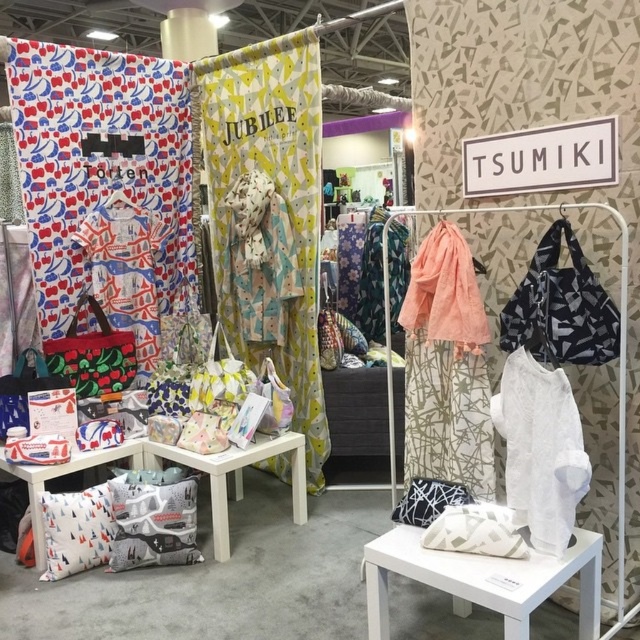
Which is below, white sheer fabric at center or patterned fabric dress at center?

white sheer fabric at center is lower down.

Does white sheer fabric at center have a greater width compared to patterned fabric dress at center?

In fact, white sheer fabric at center might be narrower than patterned fabric dress at center.

Find the location of a particular element. The image size is (640, 640). white sheer fabric at center is located at coordinates (540, 449).

From the picture: Is white fabric stool at center thinner than white sheer fabric at center?

No.

Can you confirm if white fabric stool at center is positioned to the right of white sheer fabric at center?

Incorrect, white fabric stool at center is not on the right side of white sheer fabric at center.

Which is in front, point (413, 547) or point (531, 388)?

Point (531, 388) is in front.

Locate an element on the screen. Image resolution: width=640 pixels, height=640 pixels. white fabric stool at center is located at coordinates (483, 579).

Does white fabric stool at center come behind printed fabric dress at center?

No.

Who is higher up, white fabric stool at center or printed fabric dress at center?

printed fabric dress at center

Identify the location of white fabric stool at center. (483, 579).

Where is `white fabric stool at center`? white fabric stool at center is located at coordinates (483, 579).